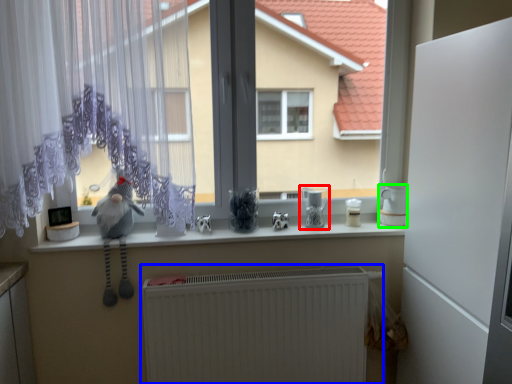
Question: Which object is the closest to the appliance (highlighted by a red box)? Choose among these: radiator (highlighted by a blue box) or appliance (highlighted by a green box).

Choices:
 (A) radiator
 (B) appliance

Answer: (B)